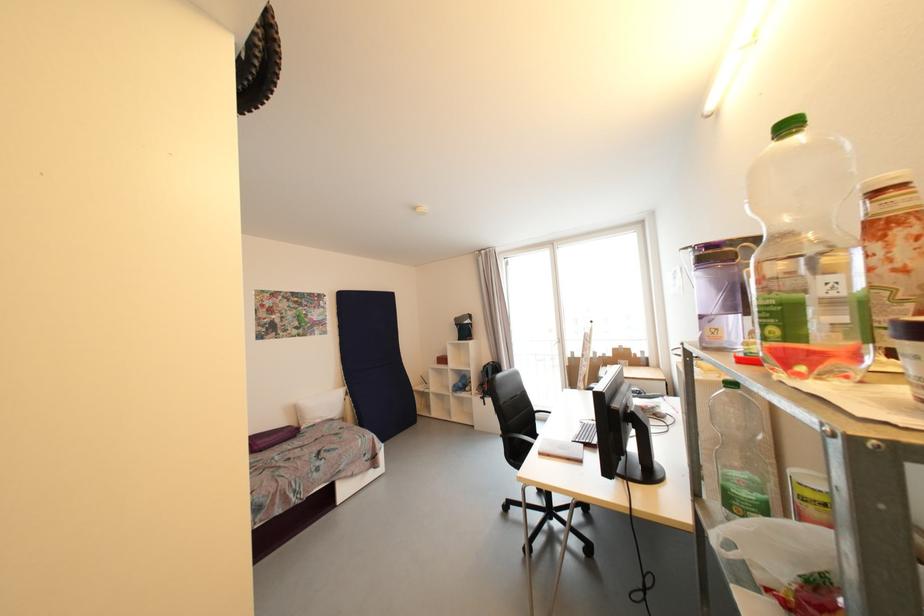
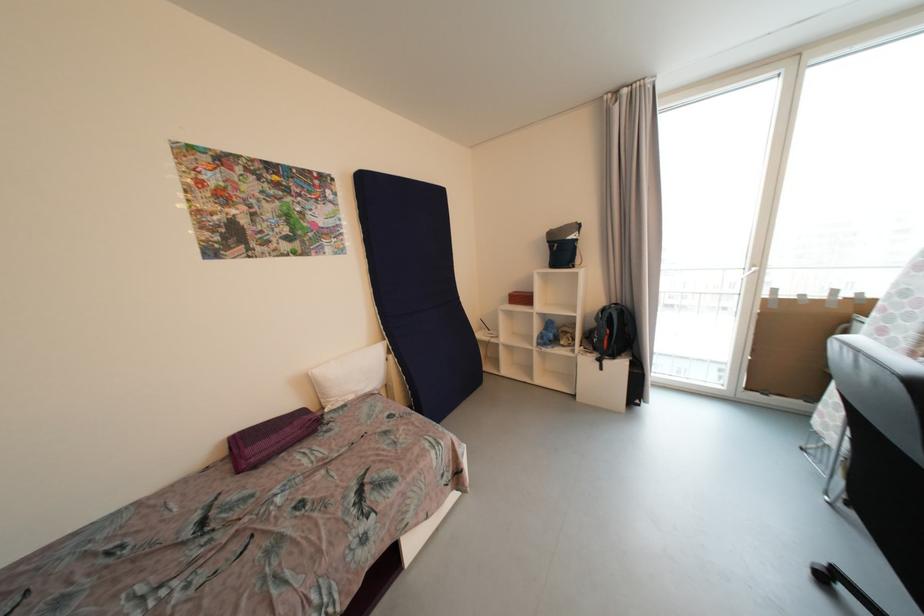
Find the pixel in the second image that matches (x=490, y=368) in the first image.

(608, 312)